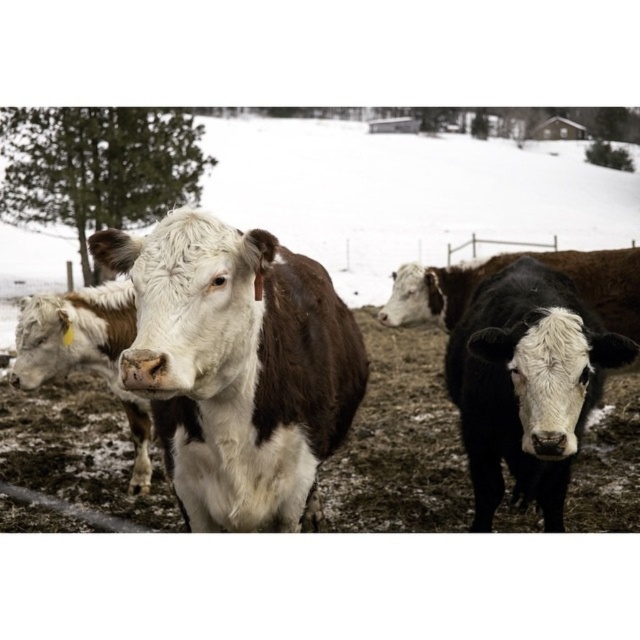
You are standing at the origin point of the coordinate system. You want to move towards the white fur cow at center. What are the coordinates you need to move to reach it?

The white fur cow at center is located at coordinates point (225,368). To reach it, you should move to that coordinate point.

You are standing at the edge of the snowy field and want to reach the point marked at coordinates point (525, 365). If your walking speed is 1.2 meters per second, how many seconds will it take you to reach that point?

The distance between point (525, 365) and the viewer is 2.50 meters. At a walking speed of 1.2 meters per second, it will take approximately 2.50 divided by 1.2, which equals about 2.08 seconds. Since you can round to the nearest whole number, it would take roughly 2 seconds to reach the point.